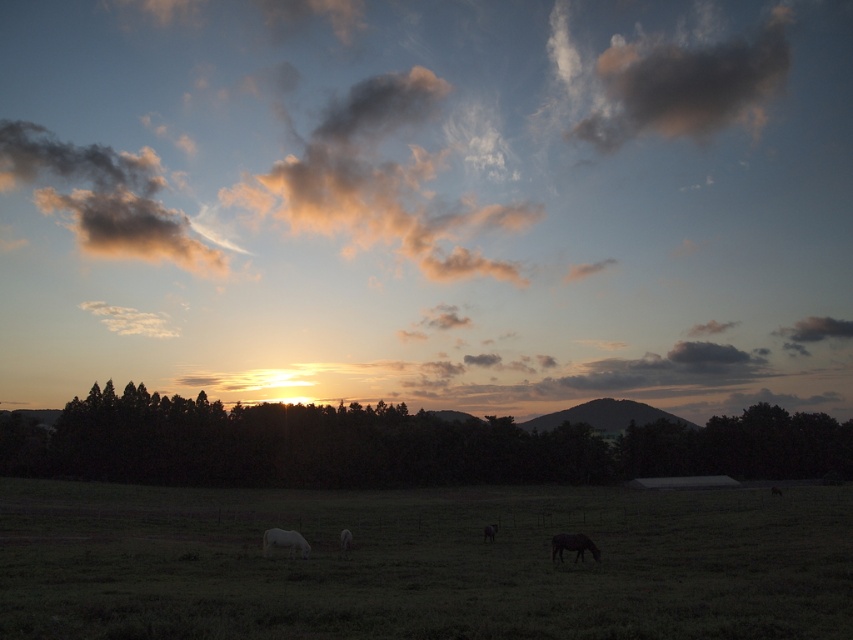
You are a farmer who needs to separate your white woolly sheep at lower left and white matte horse at lower left into two different pens. The minimum distance required between the two animals to ensure they don not disturb each other is 20 feet. Based on the scene, can you place them in the same pen?

The white woolly sheep at lower left and white matte horse at lower left are 19.32 feet apart from each other. Since the required distance is 20 feet, they cannot be placed in the same pen as the current distance is less than the required separation.

You are a photographer planning to take a picture of the white matte horse at center in the rural scene. Since the green grass pasture at center is also in the frame, will the horse be mostly hidden by the pasture?

The green grass pasture at center has a larger size compared to white matte horse at center, so the horse might be partially hidden by the pasture depending on their arrangement.

You are standing in the rural scene and want to take a photo of the dark green leafy trees at center. According to the coordinates provided, where exactly should you position yourself to capture them in the frame?

The dark green leafy trees at center are located at coordinates point (x=397, y=445), so you should position yourself facing that coordinate point to capture them in the frame.